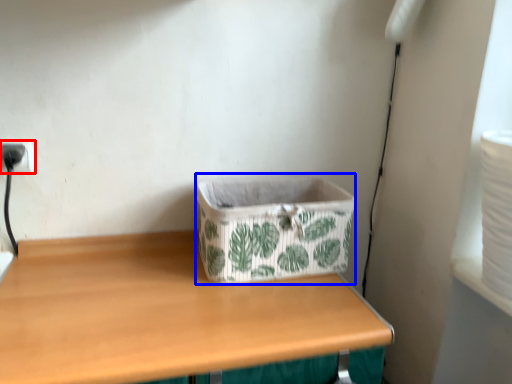
Question: Among these objects, which one is farthest to the camera, electric outlet (highlighted by a red box) or storage box (highlighted by a blue box)?

Choices:
 (A) electric outlet
 (B) storage box

Answer: (A)